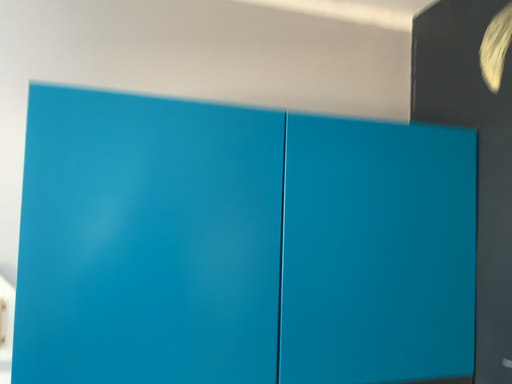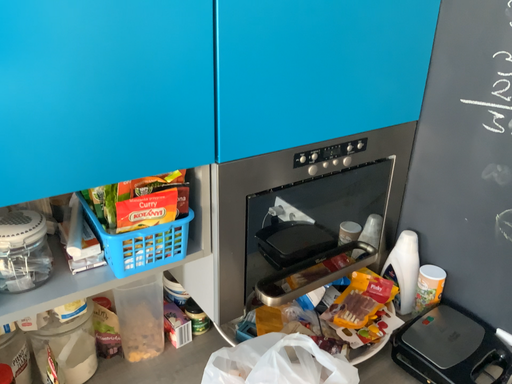
Question: Which way did the camera rotate in the video?

Choices:
 (A) rotated left
 (B) rotated right

Answer: (B)